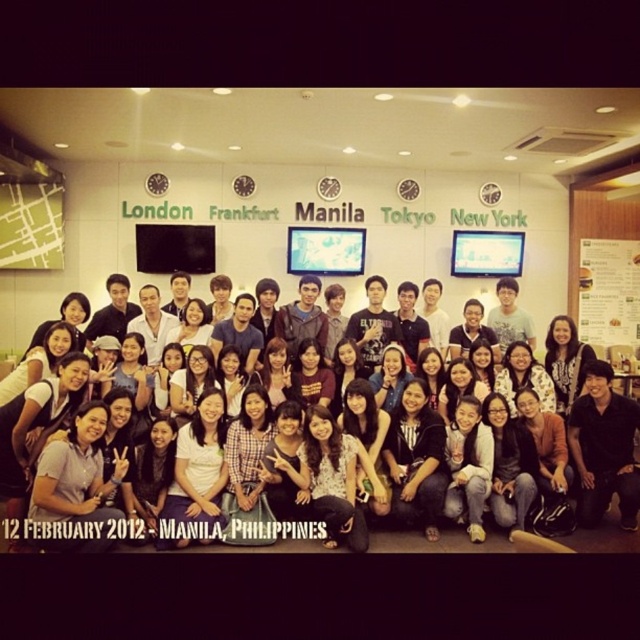
Question: Which of the following is the closest to the observer?

Choices:
 (A) white fabric shirt at center
 (B) white paper menu at right

Answer: (A)

Question: Can you confirm if white fabric shirt at center is positioned above white paper menu at right?

Choices:
 (A) no
 (B) yes

Answer: (A)

Question: Does white fabric shirt at center have a smaller size compared to white paper menu at right?

Choices:
 (A) no
 (B) yes

Answer: (B)

Question: Is white fabric shirt at center to the left of white paper menu at right from the viewer's perspective?

Choices:
 (A) no
 (B) yes

Answer: (B)

Question: Which point is farther from the camera taking this photo?

Choices:
 (A) (605, 298)
 (B) (444, 536)

Answer: (A)